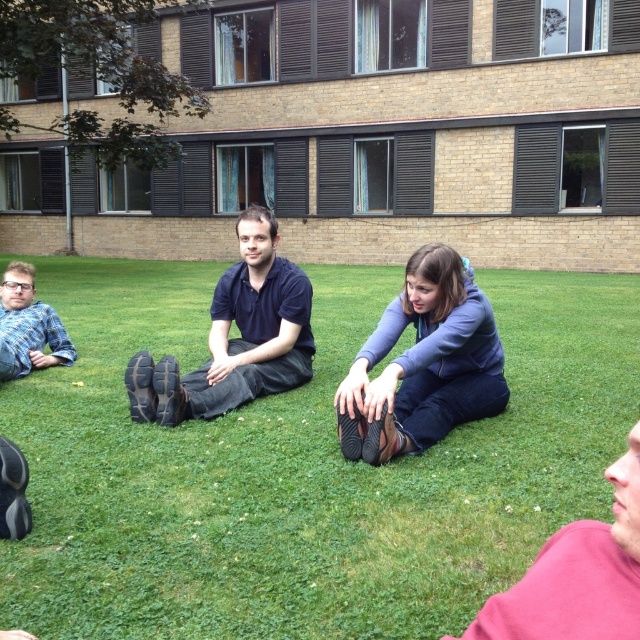
Question: Is blue denim jeans at center thinner than dark blue cotton shirt at center?

Choices:
 (A) no
 (B) yes

Answer: (B)

Question: Which object appears closest to the camera in this image?

Choices:
 (A) blue plaid shirt at lower left
 (B) blue denim jeans at center
 (C) dark blue cotton shirt at center
 (D) pink fabric shirt at lower right

Answer: (D)

Question: Among these points, which one is nearest to the camera?

Choices:
 (A) (538, 376)
 (B) (131, 365)
 (C) (540, 628)
 (D) (36, 342)

Answer: (C)

Question: Does green grass at center come behind pink fabric shirt at lower right?

Choices:
 (A) no
 (B) yes

Answer: (B)

Question: Which object appears closest to the camera in this image?

Choices:
 (A) pink fabric shirt at lower right
 (B) green grass at center

Answer: (A)

Question: Does dark blue cotton shirt at center appear on the right side of pink fabric shirt at lower right?

Choices:
 (A) yes
 (B) no

Answer: (B)